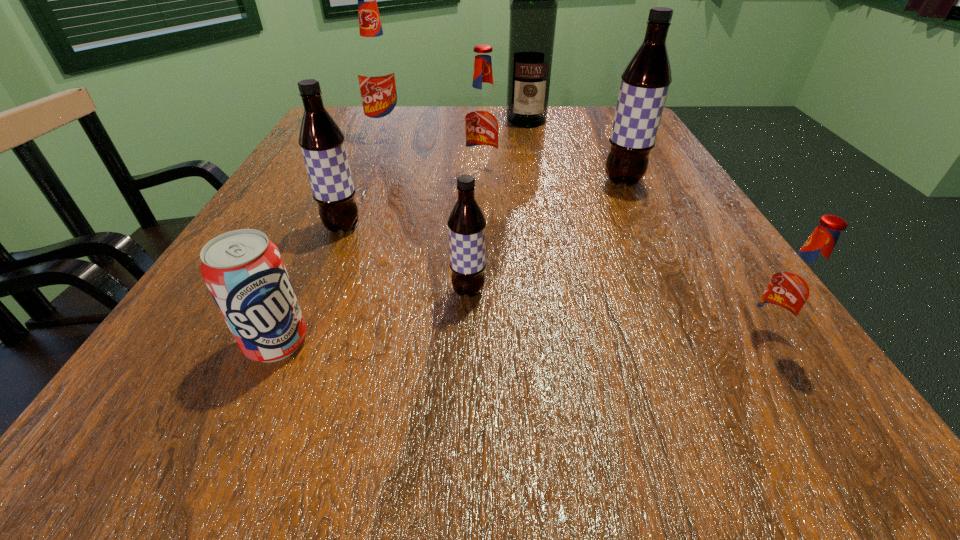
I want to click on the rightmost object, so tap(793, 289).

The width and height of the screenshot is (960, 540). Identify the location of the nearest root beer. (793, 289).

The width and height of the screenshot is (960, 540). Identify the location of the smallest brown root beer. (466, 224).

This screenshot has width=960, height=540. In order to click on the second brown root beer from left to right in this screenshot , I will do `click(466, 224)`.

Identify the location of the shortest object. This screenshot has height=540, width=960. (244, 271).

At what (x,y) coordinates should I click in order to perform the action: click on free space located on the front and back of the alcohol. Please return your answer as a coordinate pair (x, y). Looking at the image, I should click on (532, 148).

This screenshot has width=960, height=540. I want to click on free spot located on the back of the leftmost red root beer, so click(394, 117).

The width and height of the screenshot is (960, 540). I want to click on blank area located on the front of the fifth root beer from left to right, so click(x=647, y=231).

Where is `blank space located 0.070m on the front of the second biggest red root beer`? The image size is (960, 540). blank space located 0.070m on the front of the second biggest red root beer is located at coordinates (483, 200).

Locate an element on the screen. This screenshot has height=540, width=960. free space located 0.250m on the back of the second biggest brown root beer is located at coordinates (372, 153).